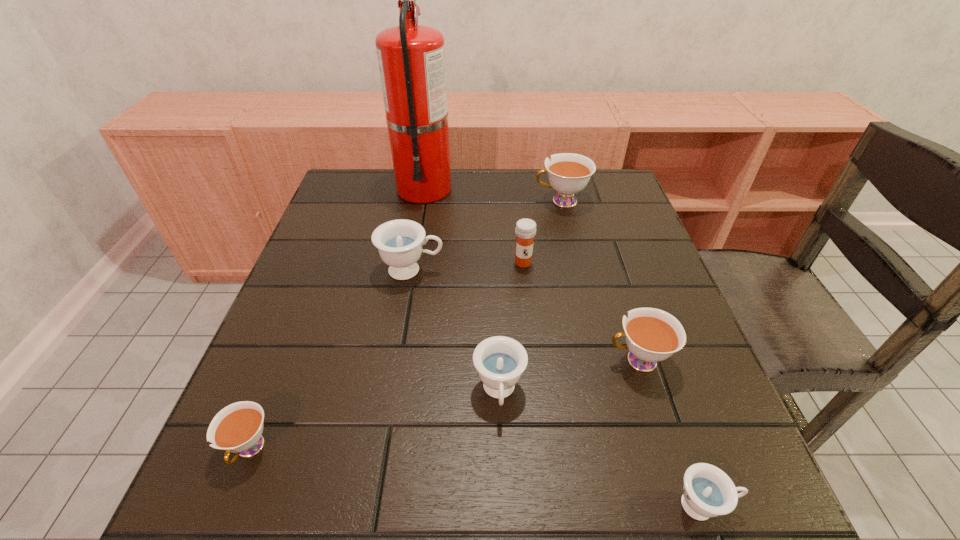
I want to click on free space located on the side of the second biggest white teacup with the handle, so click(516, 361).

Locate an element on the screen. free space located 0.260m on the side of the second biggest white teacup with the handle is located at coordinates (468, 361).

The height and width of the screenshot is (540, 960). In order to click on free region located 0.310m on the side of the second biggest white teacup with the handle in this screenshot , I will do (441, 361).

Locate an element on the screen. Image resolution: width=960 pixels, height=540 pixels. free space located 0.050m on the side of the second biggest blue teacup with the handle is located at coordinates (501, 453).

What are the coordinates of `vacant space located 0.060m on the side of the smallest white teacup with the handle` in the screenshot? It's located at (222, 521).

Identify the location of free region located on the side of the nearest blue teacup with the handle. (769, 505).

This screenshot has height=540, width=960. In order to click on fire extinguisher that is positioned at the far edge in this screenshot , I will do `click(411, 58)`.

The height and width of the screenshot is (540, 960). Identify the location of teacup located in the far edge section of the desktop. (568, 173).

Locate an element on the screen. object positioned at the left edge is located at coordinates (237, 428).

Where is `object that is at the near left corner`? object that is at the near left corner is located at coordinates (237, 428).